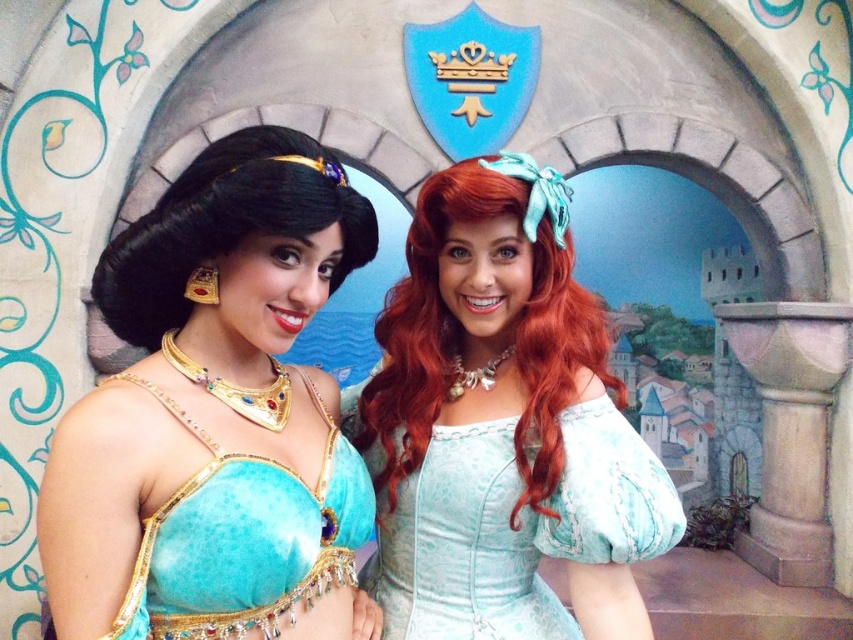
You are a photographer at a Disney event and need to adjust the lighting so that the matte teal dress at center is more visible than the turquoise velvet top at center. Which one should you focus the light on first?

The matte teal dress at center is further to the viewer than the turquoise velvet top at center, so focusing the light on the matte teal dress at center first will make it more visible.

What object is located at the coordinate point [502,433] in the image?

The point [502,433] is on the matte teal dress at center.